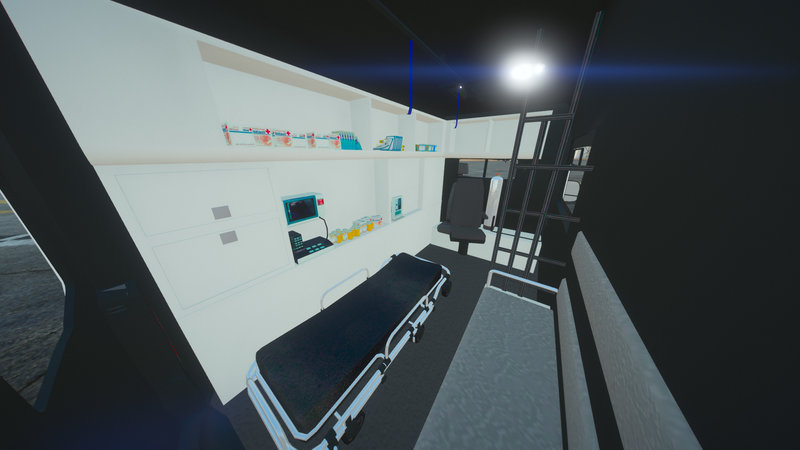
This screenshot has height=450, width=800. Find the location of `ceiling`. ceiling is located at coordinates tap(470, 28).